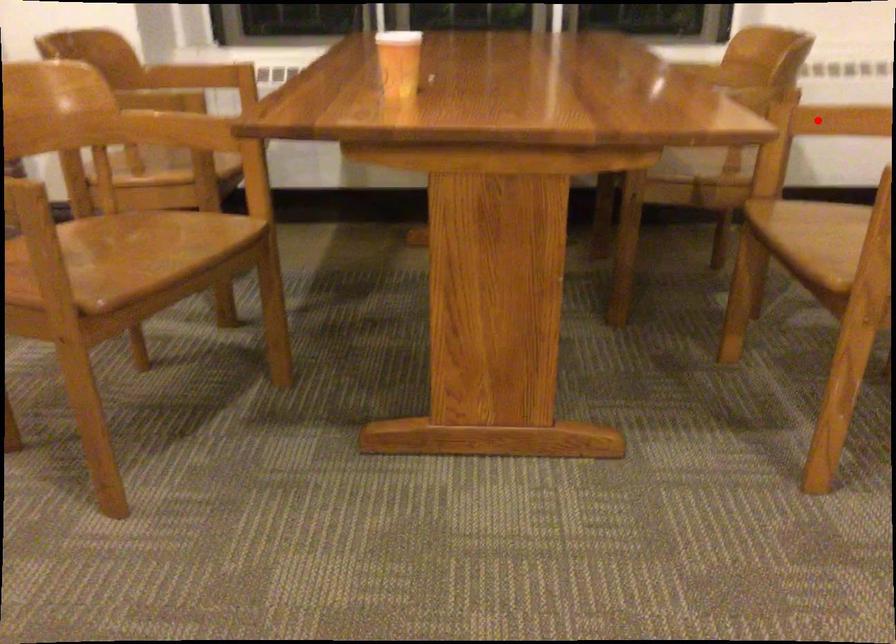
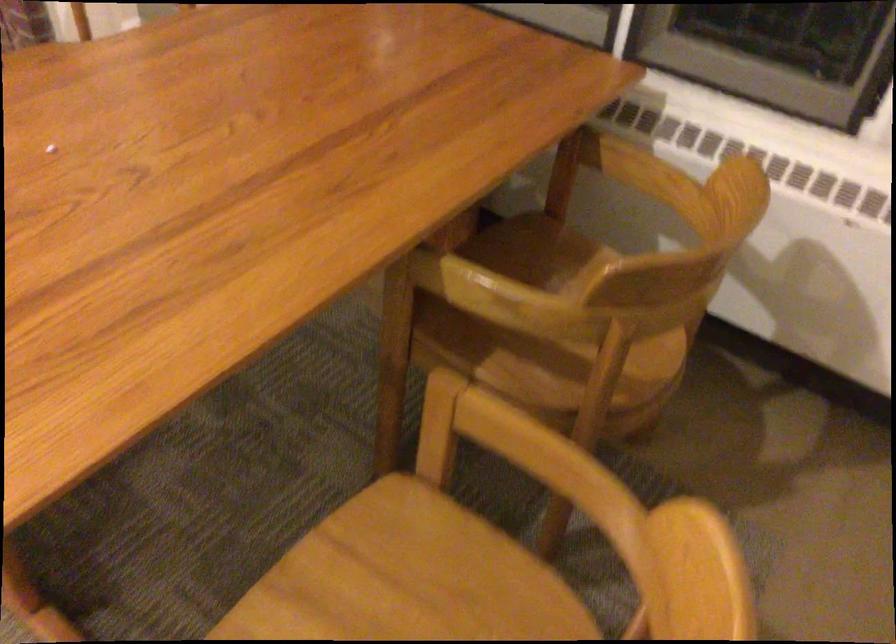
In the second image, find the point that corresponds to the highlighted location in the first image.

(501, 440)